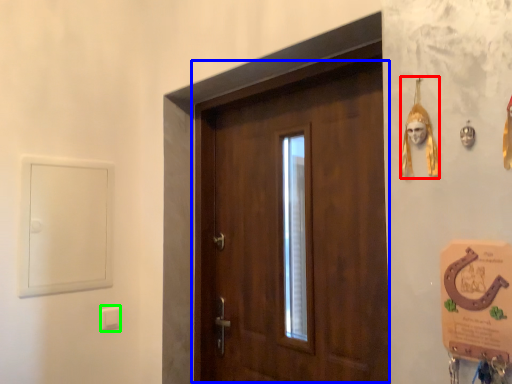
Question: Which object is the farthest from decor (highlighted by a red box)? Choose among these: door (highlighted by a blue box) or light switch (highlighted by a green box).

Choices:
 (A) door
 (B) light switch

Answer: (B)